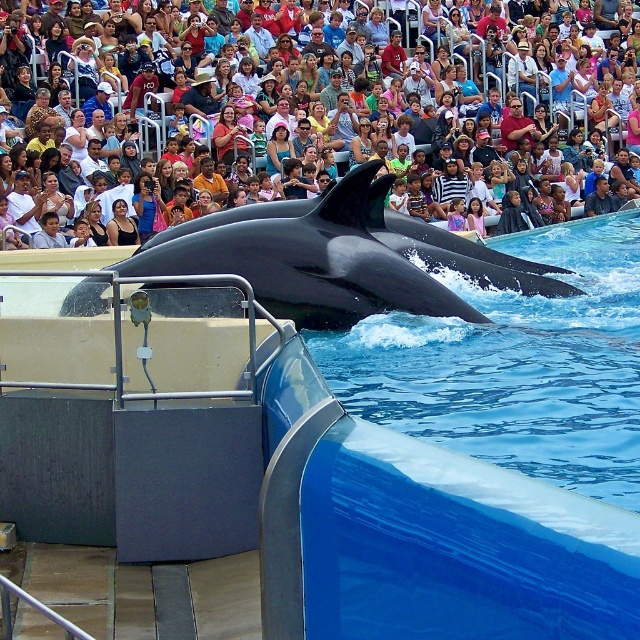
You are standing at the edge of the pool watching the dolphin show. There are two points marked in the image. The first point is at coordinate point [477,310] and the second point is at coordinate point [609,4]. From your perspective, which point do you see closer to you?

Point [477,310] is in front of point [609,4], so you see point [477,310] closer to you.

You are a spectator at the marine show and want to take a photo of both the black smooth whale at center and the matte black dolphin at center. Which one will appear larger in your photo?

The black smooth whale at center will appear larger in the photo because it is closer to the viewer than the matte black dolphin at center.

You are a marine biologist observing the black smooth whale at center during its show. Based on its position coordinates, can you determine if it is positioned exactly at the center of the pool?

The black smooth whale at center is located at coordinates point [339,257], which is close to the center but not exactly at the center point. Therefore, it is slightly offset from the exact center of the pool.